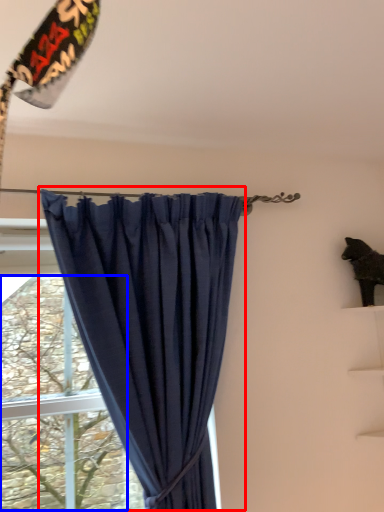
Question: Which object is closer to the camera taking this photo, curtain (highlighted by a red box) or tree (highlighted by a blue box)?

Choices:
 (A) curtain
 (B) tree

Answer: (A)